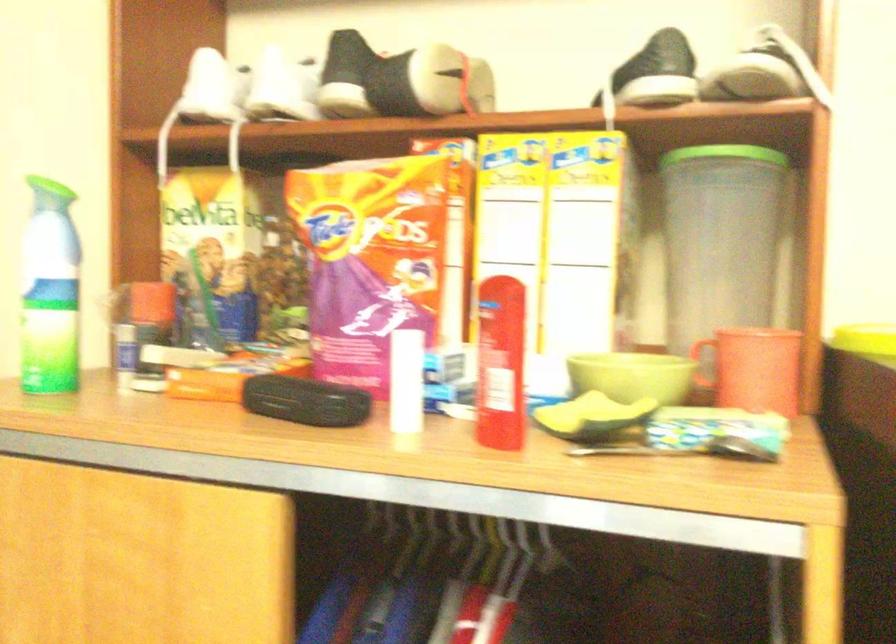
The image size is (896, 644). What do you see at coordinates (703, 364) in the screenshot?
I see `the orange mug handle` at bounding box center [703, 364].